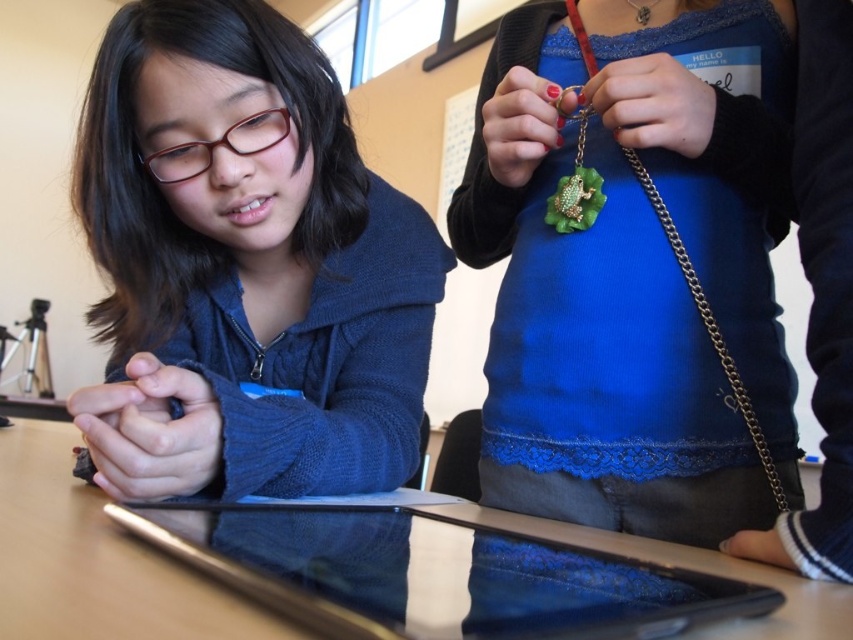
Can you confirm if green felt necklace at center is bigger than silver metallic tablet at center?

Yes, green felt necklace at center is bigger than silver metallic tablet at center.

Can you confirm if green felt necklace at center is wider than silver metallic tablet at center?

→ In fact, green felt necklace at center might be narrower than silver metallic tablet at center.

Find the location of a particular element. This screenshot has width=853, height=640. green felt necklace at center is located at coordinates (635, 264).

Between point (749, 120) and point (337, 348), which one is positioned behind?

Positioned behind is point (337, 348).

Is green felt necklace at center taller than matte blue sweater at center?

Yes.

Who is more forward, (x=527, y=26) or (x=167, y=77)?

Point (x=167, y=77) is in front.

Locate an element on the screen. The height and width of the screenshot is (640, 853). green felt necklace at center is located at coordinates (635, 264).

Which is in front, point (108, 45) or point (379, 513)?

Point (379, 513)

Identify the location of matte blue sweater at center. (245, 266).